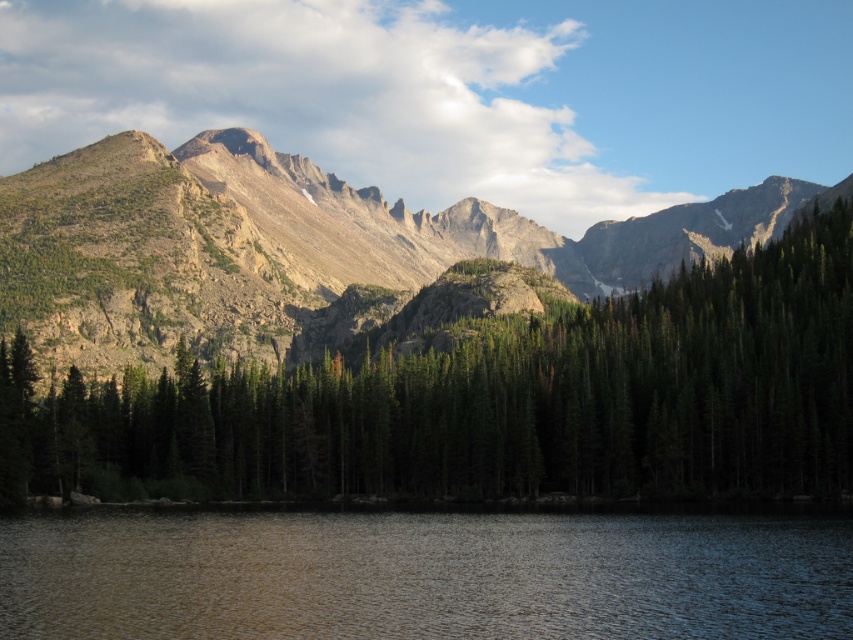
Question: Does green matte tree at center have a larger size compared to smooth reflective water at lower center?

Choices:
 (A) yes
 (B) no

Answer: (A)

Question: Can you confirm if green matte tree at center is wider than smooth reflective water at lower center?

Choices:
 (A) yes
 (B) no

Answer: (A)

Question: Which of the following is the farthest from the observer?

Choices:
 (A) smooth reflective water at lower center
 (B) green matte tree at center

Answer: (B)

Question: Among these points, which one is farthest from the camera?

Choices:
 (A) (102, 545)
 (B) (10, 346)

Answer: (B)

Question: Is green matte tree at center positioned at the back of smooth reflective water at lower center?

Choices:
 (A) yes
 (B) no

Answer: (A)